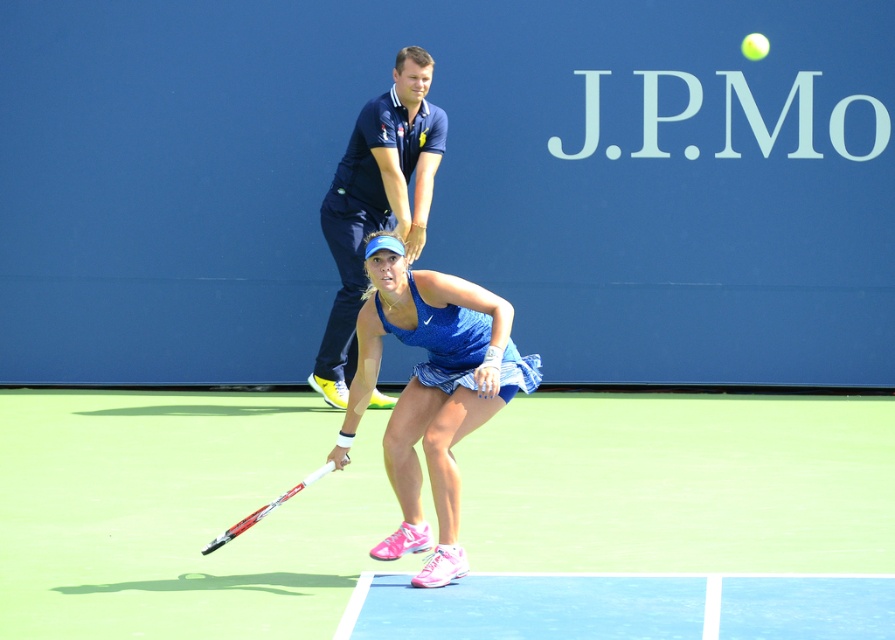
You are a photographer positioned behind the female tennis player. You want to take a photo that clearly shows both the blue fabric tennis skirt at center and the white matte tennis racket at center. Based on their positions, will the skirt block the racket in the photo?

The blue fabric tennis skirt at center is in front of the white matte tennis racket at center, so the skirt will block the racket in the photo.

You are a photographer trying to capture the tennis player and the objects in the scene. If you want to include both the green synthetic turf at center and the white matte tennis racket at center in your photo, which object should you frame larger to ensure both are clearly visible?

The green synthetic turf at center is bigger than the white matte tennis racket at center, so you should frame the green synthetic turf at center larger to accommodate its size while still including the white matte tennis racket at center.

You are a photographer standing at the edge of the tennis court. You want to capture a photo of the blue fabric tennis skirt at center without the green synthetic turf at center showing underneath it. Is this possible?

The green synthetic turf at center is positioned under the blue fabric tennis skirt at center, so it is possible to capture the photo without the green synthetic turf showing by focusing on the skirt from an angle where the turf is not visible underneath.